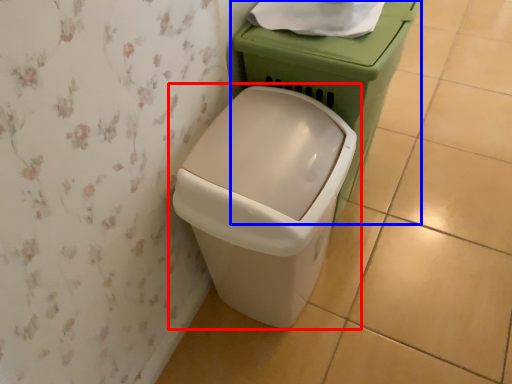
Question: Which point is closer to the camera, waste container (highlighted by a red box) or porcelain (highlighted by a blue box)?

Choices:
 (A) waste container
 (B) porcelain

Answer: (A)